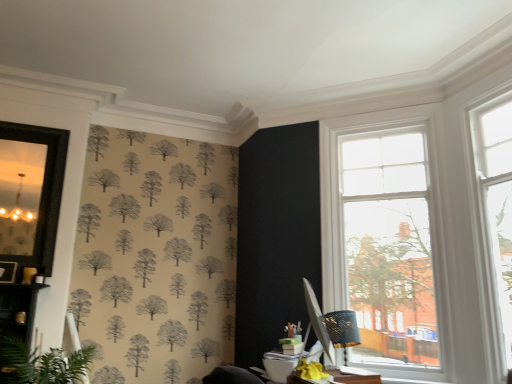
Measure the distance between clear glass window at upper right, which ranks as the 2th window in left-to-right order, and camera.

A distance of 2.73 meters exists between clear glass window at upper right, which ranks as the 2th window in left-to-right order, and camera.

Image resolution: width=512 pixels, height=384 pixels. What do you see at coordinates (385, 237) in the screenshot? I see `clear glass window at upper right, placed as the second window when sorted from right to left` at bounding box center [385, 237].

Locate an element on the screen. This screenshot has height=384, width=512. matte black lampshade at right is located at coordinates (342, 330).

Identify the location of clear glass window at upper right, the first window in the right-to-left sequence. The width and height of the screenshot is (512, 384). click(495, 221).

Is matte black lampshade at right touching matte black mirror at left?

No.

Is matte black lampshade at right positioned before matte black mirror at left?

Yes, it is in front of matte black mirror at left.

Which is more to the left, matte black lampshade at right or matte black mirror at left?

Positioned to the left is matte black mirror at left.

Considering the relative sizes of matte black lampshade at right and matte black mirror at left in the image provided, is matte black lampshade at right thinner than matte black mirror at left?

Incorrect, the width of matte black lampshade at right is not less than that of matte black mirror at left.

How distant is matte black mirror at left from green leafy plant at lower left?

matte black mirror at left and green leafy plant at lower left are 37.31 inches apart from each other.

Would you consider matte black mirror at left to be distant from green leafy plant at lower left?

No, matte black mirror at left is not far away from green leafy plant at lower left.

Is point (1, 129) closer to viewer compared to point (12, 362)?

No, it is behind (12, 362).

From a real-world perspective, is matte black mirror at left under green leafy plant at lower left?

No, from a real-world perspective, matte black mirror at left is not beneath green leafy plant at lower left.

Where is `houseplant on the left of clear glass window at upper right, placed as the second window when sorted from right to left`? The width and height of the screenshot is (512, 384). houseplant on the left of clear glass window at upper right, placed as the second window when sorted from right to left is located at coordinates (41, 364).

How different are the orientations of clear glass window at upper right, placed as the second window when sorted from right to left, and green leafy plant at lower left in degrees?

They differ by 47.2 degrees in their facing directions.

Looking at their sizes, would you say clear glass window at upper right, which is the 1th window in left-to-right order, is wider or thinner than green leafy plant at lower left?

Clearly, clear glass window at upper right, which is the 1th window in left-to-right order, has less width compared to green leafy plant at lower left.

From a real-world perspective, is clear glass window at upper right, which is the 1th window in left-to-right order, located higher than green leafy plant at lower left?

Yes, from a real-world perspective, clear glass window at upper right, which is the 1th window in left-to-right order, is over green leafy plant at lower left

Would you say green leafy plant at lower left is outside clear glass window at upper right, which is the 1th window in left-to-right order?

Indeed, green leafy plant at lower left is completely outside clear glass window at upper right, which is the 1th window in left-to-right order.

Who is shorter, green leafy plant at lower left or clear glass window at upper right, which is the 1th window in left-to-right order?

With less height is green leafy plant at lower left.

From the picture: Is green leafy plant at lower left turned away from clear glass window at upper right, placed as the second window when sorted from right to left?

green leafy plant at lower left does not have its back to clear glass window at upper right, placed as the second window when sorted from right to left.

Which of these two, green leafy plant at lower left or clear glass window at upper right, which is the 1th window in left-to-right order, is thinner?

Thinner between the two is clear glass window at upper right, which is the 1th window in left-to-right order.

Which is closer, (45,207) or (332,330)?

Point (45,207).

Is matte black mirror at left oriented away from matte black lampshade at right?

No.

Where is `table lamp in front of the matte black mirror at left`? The width and height of the screenshot is (512, 384). table lamp in front of the matte black mirror at left is located at coordinates (342, 330).

Is matte black mirror at left not near matte black lampshade at right?

matte black mirror at left is far away from matte black lampshade at right.

From a real-world perspective, is green leafy plant at lower left physically located above or below clear glass window at upper right, the first window in the right-to-left sequence?

green leafy plant at lower left is below clear glass window at upper right, the first window in the right-to-left sequence.

Are green leafy plant at lower left and clear glass window at upper right, which ranks as the 2th window in left-to-right order, making contact?

No.

From the green leafy plant at lower left, count 2nd window to the right and point to it. Please provide its 2D coordinates.

[(495, 221)]

From the image's perspective, between matte black mirror at left and clear glass window at upper right, which is the 1th window in left-to-right order, who is located below?

clear glass window at upper right, which is the 1th window in left-to-right order, appears lower in the image.

From a real-world perspective, is matte black mirror at left below clear glass window at upper right, which is the 1th window in left-to-right order?

Actually, matte black mirror at left is physically above clear glass window at upper right, which is the 1th window in left-to-right order, in the real world.

Between matte black mirror at left and clear glass window at upper right, which is the 1th window in left-to-right order, which one appears on the right side from the viewer's perspective?

Positioned to the right is clear glass window at upper right, which is the 1th window in left-to-right order.

Locate an element on the screen. window screen located on the left of clear glass window at upper right, which is the 1th window in left-to-right order is located at coordinates (32, 193).

This screenshot has height=384, width=512. I want to click on table lamp below the matte black mirror at left (from the image's perspective), so click(342, 330).

This screenshot has height=384, width=512. What are the coordinates of `window screen above the green leafy plant at lower left (from the image's perspective)` in the screenshot? It's located at (32, 193).

When comparing their distances from matte black lampshade at right, does green leafy plant at lower left or clear glass window at upper right, the first window in the right-to-left sequence, seem further?

Based on the image, green leafy plant at lower left appears to be further to matte black lampshade at right.

Considering their positions, is matte black mirror at left positioned closer to clear glass window at upper right, the first window in the right-to-left sequence, than green leafy plant at lower left?

green leafy plant at lower left is positioned closer to the anchor clear glass window at upper right, the first window in the right-to-left sequence.

Based on their spatial positions, is clear glass window at upper right, the first window in the right-to-left sequence, or matte black lampshade at right further from clear glass window at upper right, placed as the second window when sorted from right to left?

Based on the image, matte black lampshade at right appears to be further to clear glass window at upper right, placed as the second window when sorted from right to left.

Which object lies further to the anchor point matte black mirror at left, matte black lampshade at right or clear glass window at upper right, which ranks as the 2th window in left-to-right order?

The object further to matte black mirror at left is clear glass window at upper right, which ranks as the 2th window in left-to-right order.

Based on their spatial positions, is matte black lampshade at right or green leafy plant at lower left further from clear glass window at upper right, placed as the second window when sorted from right to left?

The object further to clear glass window at upper right, placed as the second window when sorted from right to left, is green leafy plant at lower left.

Considering their positions, is matte black lampshade at right positioned closer to green leafy plant at lower left than clear glass window at upper right, which is the 1th window in left-to-right order?

Among the two, matte black lampshade at right is located nearer to green leafy plant at lower left.

Estimate the real-world distances between objects in this image. Which object is closer to green leafy plant at lower left, clear glass window at upper right, the first window in the right-to-left sequence, or clear glass window at upper right, placed as the second window when sorted from right to left?

clear glass window at upper right, placed as the second window when sorted from right to left, is closer to green leafy plant at lower left.

When comparing their distances from clear glass window at upper right, which ranks as the 2th window in left-to-right order, does green leafy plant at lower left or clear glass window at upper right, placed as the second window when sorted from right to left, seem further?

Among the two, green leafy plant at lower left is located further to clear glass window at upper right, which ranks as the 2th window in left-to-right order.

Find the location of a particular element. The width and height of the screenshot is (512, 384). table lamp situated between matte black mirror at left and clear glass window at upper right, which ranks as the 2th window in left-to-right order, from left to right is located at coordinates (342, 330).

Locate an element on the screen. The height and width of the screenshot is (384, 512). window between green leafy plant at lower left and clear glass window at upper right, which ranks as the 2th window in left-to-right order is located at coordinates (385, 237).

Find the location of a particular element. houseplant between matte black mirror at left and matte black lampshade at right from left to right is located at coordinates (41, 364).

Locate an element on the screen. table lamp between green leafy plant at lower left and clear glass window at upper right, the first window in the right-to-left sequence is located at coordinates (342, 330).